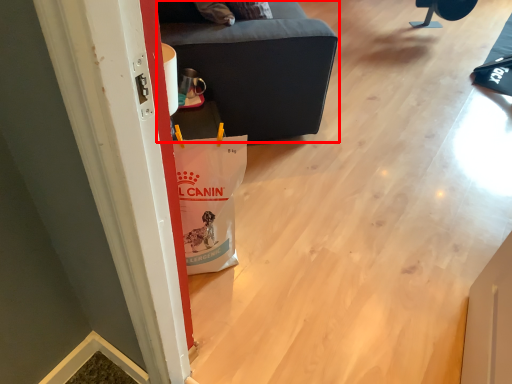
Question: From the image's perspective, considering the relative positions of furniture (annotated by the red box) and furniture in the image provided, where is furniture (annotated by the red box) located with respect to the staircase?

Choices:
 (A) below
 (B) above

Answer: (A)